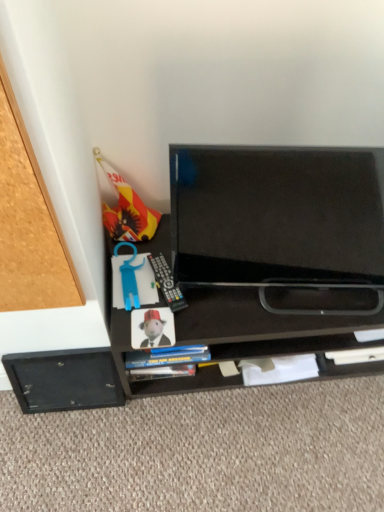
Image resolution: width=384 pixels, height=512 pixels. I want to click on vacant space that's between matte paper book at center and black glossy tv at center, so click(x=250, y=325).